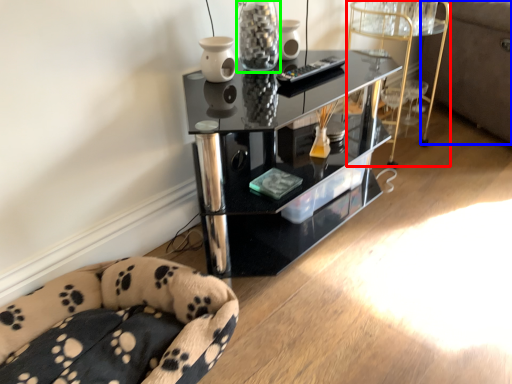
Question: Based on their relative distances, which object is nearer to side table (highlighted by a red box)? Choose from couch (highlighted by a blue box) and glass vase (highlighted by a green box).

Choices:
 (A) couch
 (B) glass vase

Answer: (A)